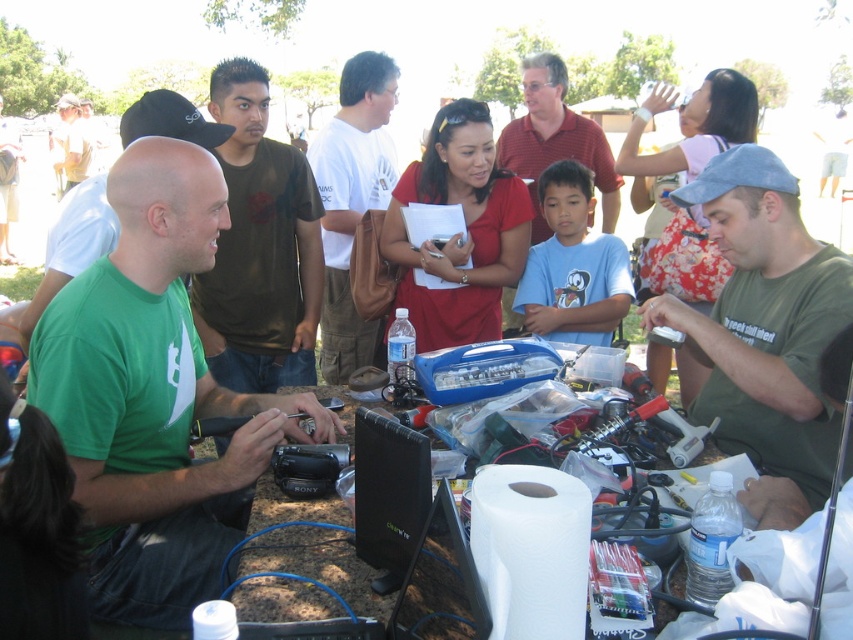
Question: Is white cotton shirt at center positioned behind matte khaki shirt at upper left?

Choices:
 (A) yes
 (B) no

Answer: (B)

Question: Among these points, which one is farthest from the camera?

Choices:
 (A) (264, 252)
 (B) (753, 246)

Answer: (A)

Question: Among these objects, which one is farthest from the camera?

Choices:
 (A) green matte shirt at lower right
 (B) matte khaki shirt at upper left
 (C) white paper towel at lower center

Answer: (B)

Question: Is white cotton shirt at center wider than matte red polo shirt at center?

Choices:
 (A) no
 (B) yes

Answer: (B)

Question: Which object is the closest to the white cotton shirt at center?

Choices:
 (A) green matte shirt at lower right
 (B) matte red polo shirt at center
 (C) green matte shirt at center

Answer: (B)

Question: Can you confirm if matte red polo shirt at center is bigger than matte khaki shirt at upper left?

Choices:
 (A) no
 (B) yes

Answer: (A)